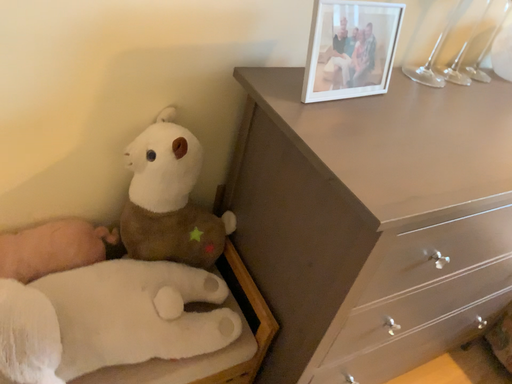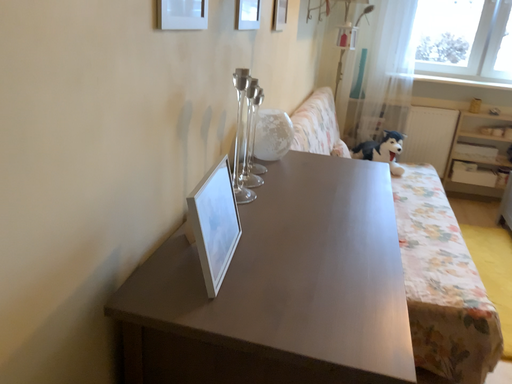
Question: Which way did the camera rotate in the video?

Choices:
 (A) rotated downward
 (B) rotated upward

Answer: (B)